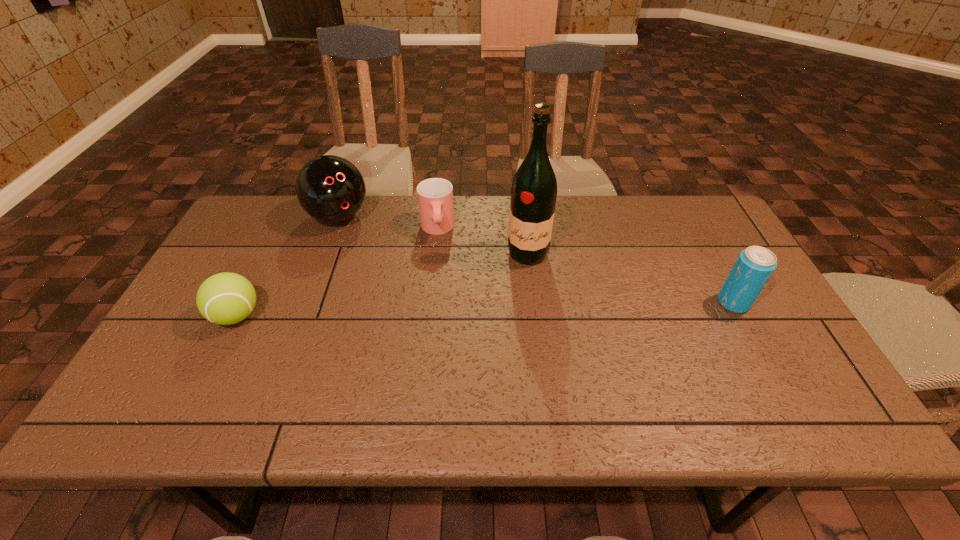
Image resolution: width=960 pixels, height=540 pixels. I want to click on cup at the far edge, so click(435, 195).

This screenshot has width=960, height=540. What are the coordinates of `bowling ball that is at the far edge` in the screenshot? It's located at (331, 189).

The image size is (960, 540). Identify the location of object positioned at the left edge. [x=226, y=298].

Image resolution: width=960 pixels, height=540 pixels. Identify the location of object that is at the right edge. (754, 266).

What are the coordinates of `free space at the far edge of the desktop` in the screenshot? It's located at (392, 199).

Where is `blank space at the near edge of the desktop`? blank space at the near edge of the desktop is located at coordinates (669, 371).

Find the location of a particular element. The image size is (960, 540). vacant space at the right edge is located at coordinates (764, 290).

In the image, there is a desktop. Where is `free space at the far left corner`? The width and height of the screenshot is (960, 540). free space at the far left corner is located at coordinates (248, 215).

In order to click on vacant space that is in between the second tallest object and the liquor in this screenshot , I will do `click(433, 235)`.

Where is `free point between the tallest object and the fourth shortest object`? Image resolution: width=960 pixels, height=540 pixels. free point between the tallest object and the fourth shortest object is located at coordinates (433, 235).